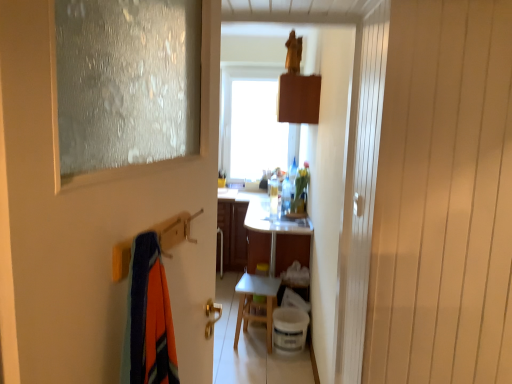
Question: Relative to white glossy vanity at center, is frosted glass door at left in front or behind?

Choices:
 (A) behind
 (B) front

Answer: (B)

Question: In terms of height, does frosted glass door at left look taller or shorter compared to white glossy vanity at center?

Choices:
 (A) short
 (B) tall

Answer: (B)

Question: Which object is positioned farthest from the white glossy vanity at center?

Choices:
 (A) white matte table at center
 (B) frosted glass door at left
 (C) translucent plastic bottle at center

Answer: (B)

Question: Based on their relative distances, which object is farther from the white glossy vanity at center?

Choices:
 (A) white matte table at center
 (B) frosted glass door at left
 (C) translucent plastic bottle at center

Answer: (B)